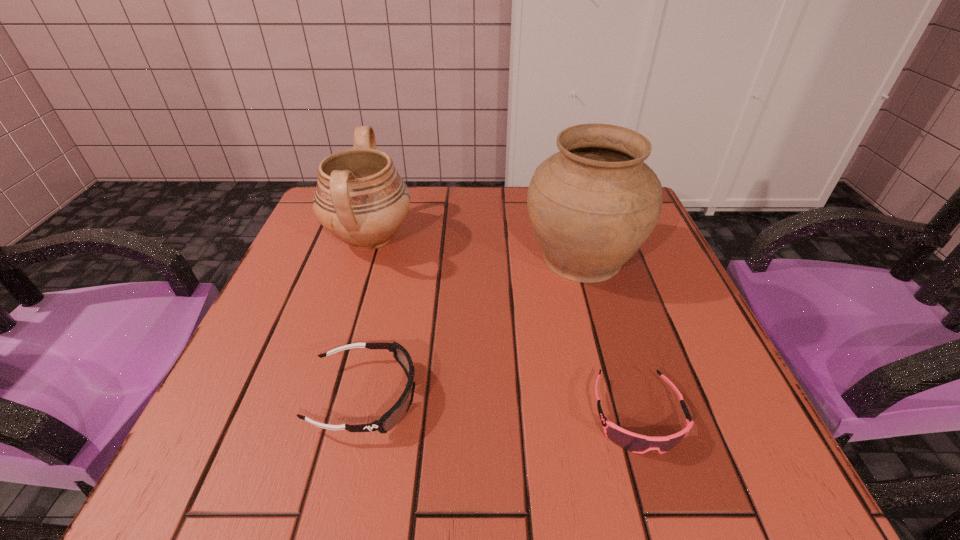
The height and width of the screenshot is (540, 960). Find the location of `free space between the shorter urn and the shortest object`. free space between the shorter urn and the shortest object is located at coordinates (504, 326).

Identify the location of vacant area that lies between the right urn and the shorter goggles. The image size is (960, 540). (610, 336).

You are a GUI agent. You are given a task and a screenshot of the screen. Output one action in this format:
    pyautogui.click(x=<x>, y=<y>)
    Task: Click on the free spot between the taller goggles and the third shortest object
    The image size is (960, 540).
    Given the screenshot: What is the action you would take?
    pyautogui.click(x=368, y=317)

Locate an element on the screen. vacant space that is in between the third tallest object and the shorter goggles is located at coordinates click(501, 406).

Locate which object is the third closest to the right urn. Please provide its 2D coordinates. Your answer should be formatted as a tuple, i.e. [(x, y)], where the tuple contains the x and y coordinates of a point satisfying the conditions above.

[(360, 198)]

Identify the location of object that stands as the closest to the shorter goggles. (592, 205).

Where is `free space that satisfies the following two spatial constraints: 1. on the front-facing side of the second tallest object; 2. on the left side of the tallest object`? Image resolution: width=960 pixels, height=540 pixels. free space that satisfies the following two spatial constraints: 1. on the front-facing side of the second tallest object; 2. on the left side of the tallest object is located at coordinates (363, 258).

The height and width of the screenshot is (540, 960). I want to click on vacant space that satisfies the following two spatial constraints: 1. on the front-facing side of the taller urn; 2. on the right side of the shorter urn, so click(363, 258).

This screenshot has width=960, height=540. I want to click on free space that satisfies the following two spatial constraints: 1. on the front-facing side of the right urn; 2. on the left side of the third shortest object, so click(363, 258).

The image size is (960, 540). Find the location of `free space that satisfies the following two spatial constraints: 1. on the front-facing side of the taller urn; 2. on the left side of the left urn`. free space that satisfies the following two spatial constraints: 1. on the front-facing side of the taller urn; 2. on the left side of the left urn is located at coordinates (363, 258).